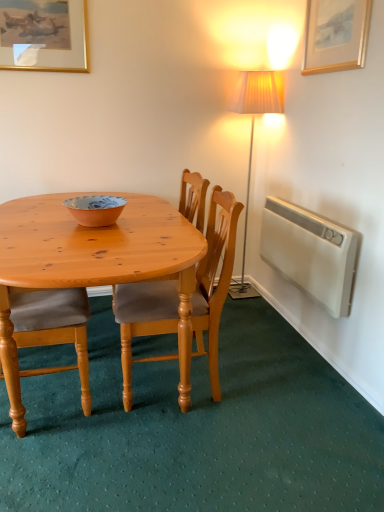
Question: Should I look upward or downward to see light brown wood chair at center, the first chair in the right-to-left sequence?

Choices:
 (A) up
 (B) down

Answer: (B)

Question: From a real-world perspective, is wooden chair at left, which is the second chair in right-to-left order, physically below matte orange bowl at center?

Choices:
 (A) yes
 (B) no

Answer: (A)

Question: Is wooden chair at left, the 1th chair positioned from the left, located outside matte orange bowl at center?

Choices:
 (A) no
 (B) yes

Answer: (B)

Question: Is matte orange bowl at center completely or partially inside wooden chair at left, the 1th chair positioned from the left?

Choices:
 (A) no
 (B) yes

Answer: (A)

Question: From a real-world perspective, is wooden chair at left, which is the second chair in right-to-left order, on top of matte orange bowl at center?

Choices:
 (A) no
 (B) yes

Answer: (A)

Question: Does wooden chair at left, which is the second chair in right-to-left order, have a greater height compared to matte orange bowl at center?

Choices:
 (A) yes
 (B) no

Answer: (A)

Question: Is wooden chair at left, the 1th chair positioned from the left, to the right of matte orange bowl at center from the viewer's perspective?

Choices:
 (A) yes
 (B) no

Answer: (B)

Question: From a real-world perspective, is matte orange bowl at center beneath light brown wood chair at center, the first chair in the right-to-left sequence?

Choices:
 (A) no
 (B) yes

Answer: (A)

Question: Is matte orange bowl at center in contact with light brown wood chair at center, the first chair in the right-to-left sequence?

Choices:
 (A) yes
 (B) no

Answer: (B)

Question: Is matte orange bowl at center shorter than light brown wood chair at center, the first chair in the right-to-left sequence?

Choices:
 (A) yes
 (B) no

Answer: (A)

Question: From the image's perspective, does matte orange bowl at center appear lower than light brown wood chair at center, the first chair in the right-to-left sequence?

Choices:
 (A) yes
 (B) no

Answer: (B)

Question: Is matte orange bowl at center closer to the viewer compared to light brown wood chair at center, the first chair in the right-to-left sequence?

Choices:
 (A) no
 (B) yes

Answer: (A)

Question: Is matte orange bowl at center positioned with its back to light brown wood chair at center, the first chair in the right-to-left sequence?

Choices:
 (A) no
 (B) yes

Answer: (A)

Question: Considering the relative sizes of gold-framed picture at upper left, the second picture frame when ordered from front to back, and white plastic radiator at right in the image provided, is gold-framed picture at upper left, the second picture frame when ordered from front to back, bigger than white plastic radiator at right?

Choices:
 (A) no
 (B) yes

Answer: (A)